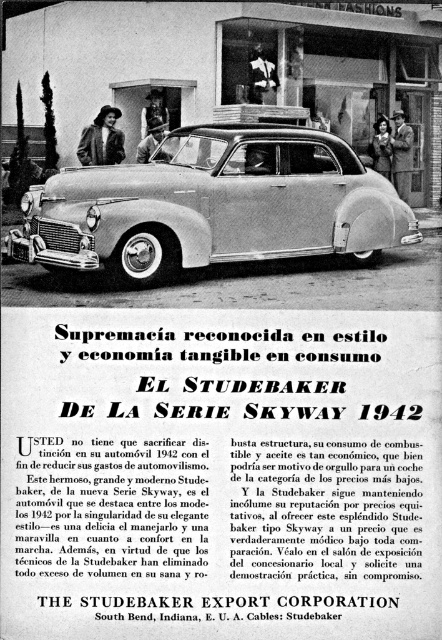
You are a customer looking at two leather jackets in a store window. The jackets are the leather jacket at upper left and the smooth leather jacket at center. Which jacket is closer to you?

The leather jacket at upper left is closer to you because it is positioned in front of the smooth leather jacket at center.

In the scene shown: What is located at the coordinate point (213, 205) in the vintage Studebaker advertisement?

At point (213, 205) lies the silver metallic sedan at center.

You are standing in front of the vintage Studebaker Skyway car advertisement. You see a leather jacket at upper left and a smooth leather jacket at center. Which jacket is closer to you?

The leather jacket at upper left is closer to you since it is only 16.93 feet away from the smooth leather jacket at center, meaning it is positioned nearer to the viewer.